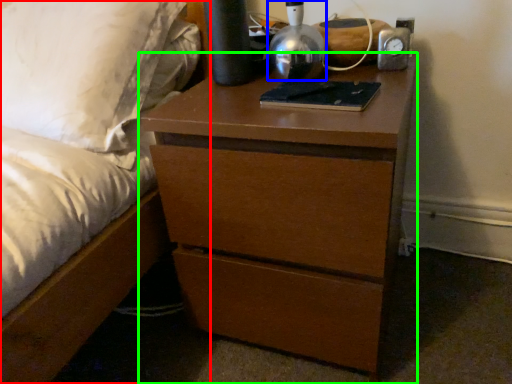
Question: Which object is the closest to the bed (highlighted by a red box)? Choose among these: bedside lamp (highlighted by a blue box) or chest of drawers (highlighted by a green box).

Choices:
 (A) bedside lamp
 (B) chest of drawers

Answer: (B)